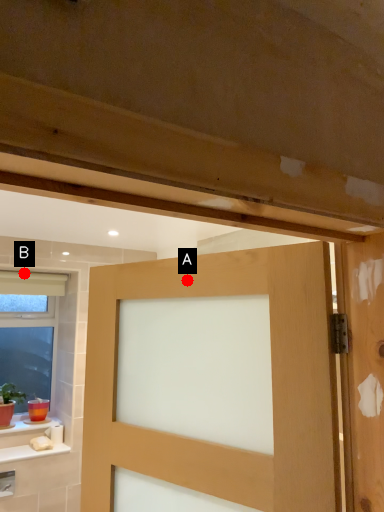
Question: Two points are circled on the image, labeled by A and B beside each circle. Which of the following is the farthest from the observer?

Choices:
 (A) A is further
 (B) B is further

Answer: (B)